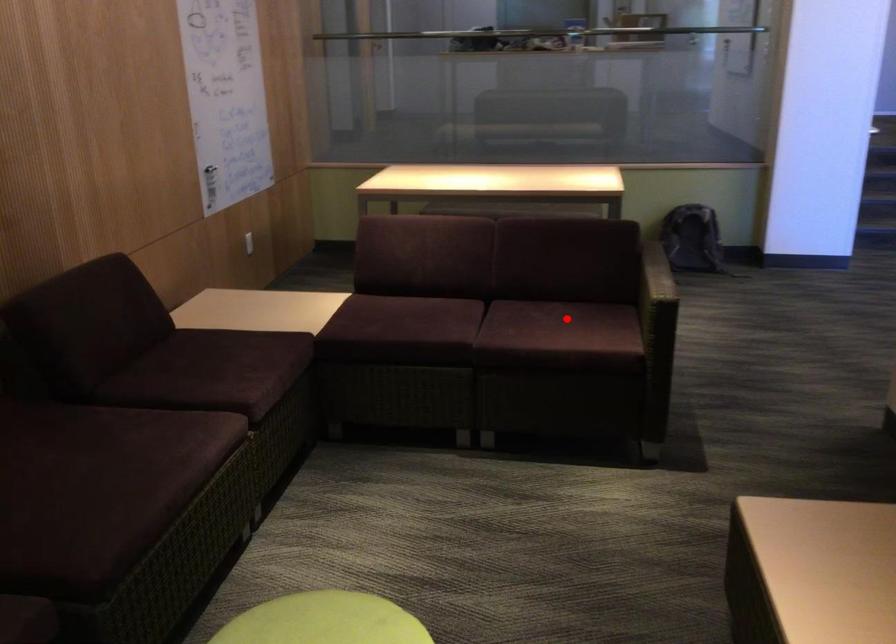
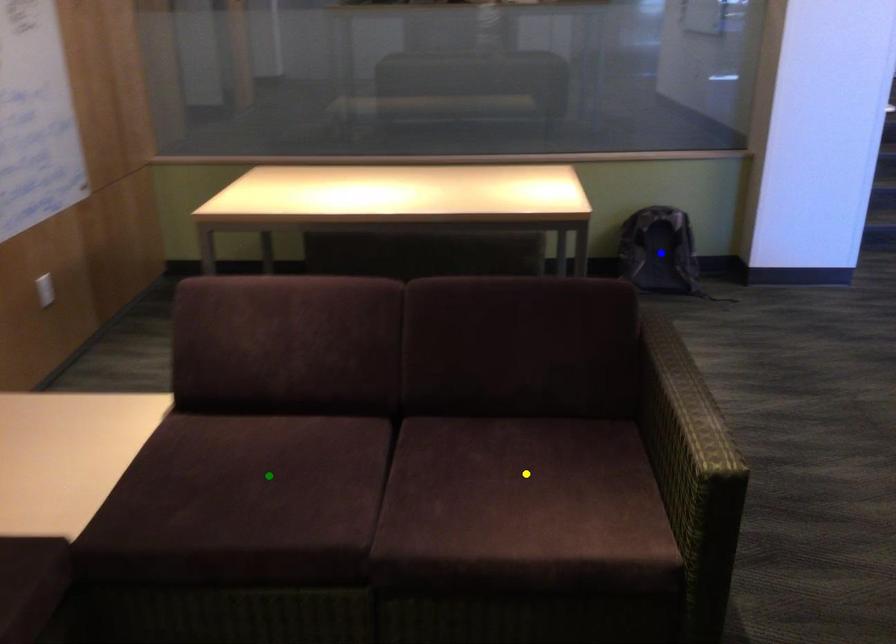
Question: I am providing you with two images of the same scene from different viewpoints. A red point is marked on the first image. You are given multiple points on the second image. Which spot in image 2 lines up with the point in image 1?

Choices:
 (A) green point
 (B) blue point
 (C) yellow point

Answer: (C)